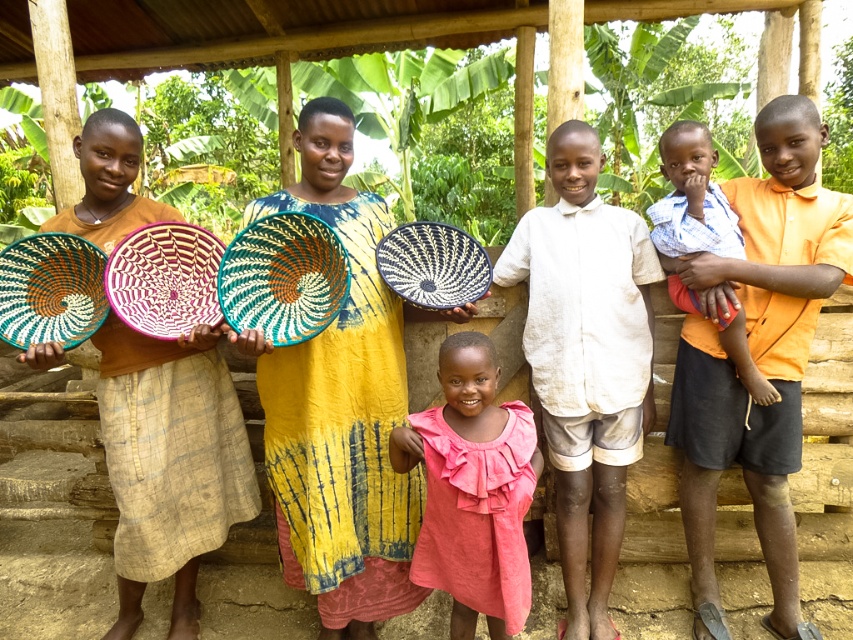
Question: Does orange cotton shirt at center lie in front of pink cotton dress at center?

Choices:
 (A) yes
 (B) no

Answer: (B)

Question: Does pink cotton dress at center have a greater width compared to blue plaid shirt at center?

Choices:
 (A) yes
 (B) no

Answer: (A)

Question: Among these points, which one is nearest to the camera?

Choices:
 (A) (199, 472)
 (B) (518, 604)
 (C) (552, 132)

Answer: (B)

Question: Among these objects, which one is nearest to the camera?

Choices:
 (A) blue plaid shirt at center
 (B) pink cotton dress at center
 (C) black woven basket at center

Answer: (B)

Question: Which point is farther to the camera?

Choices:
 (A) black woven basket at center
 (B) multicolored woven basket at center

Answer: (A)

Question: Can you confirm if pink cotton dress at center is positioned below blue plaid shirt at center?

Choices:
 (A) yes
 (B) no

Answer: (A)